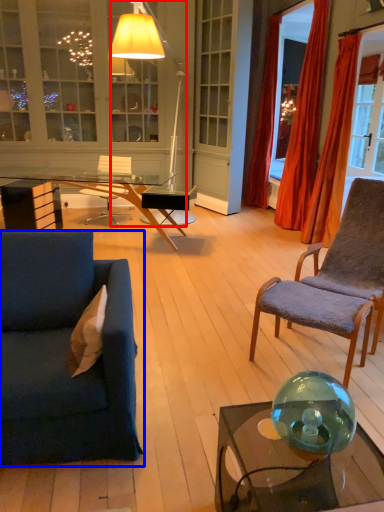
Question: Among these objects, which one is farthest to the camera, lamp (highlighted by a red box) or studio couch (highlighted by a blue box)?

Choices:
 (A) lamp
 (B) studio couch

Answer: (A)